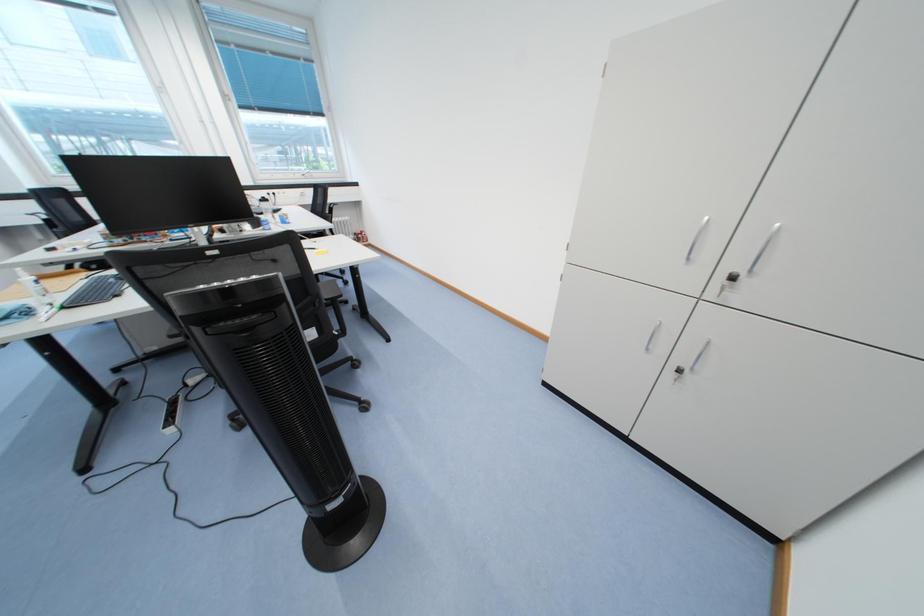
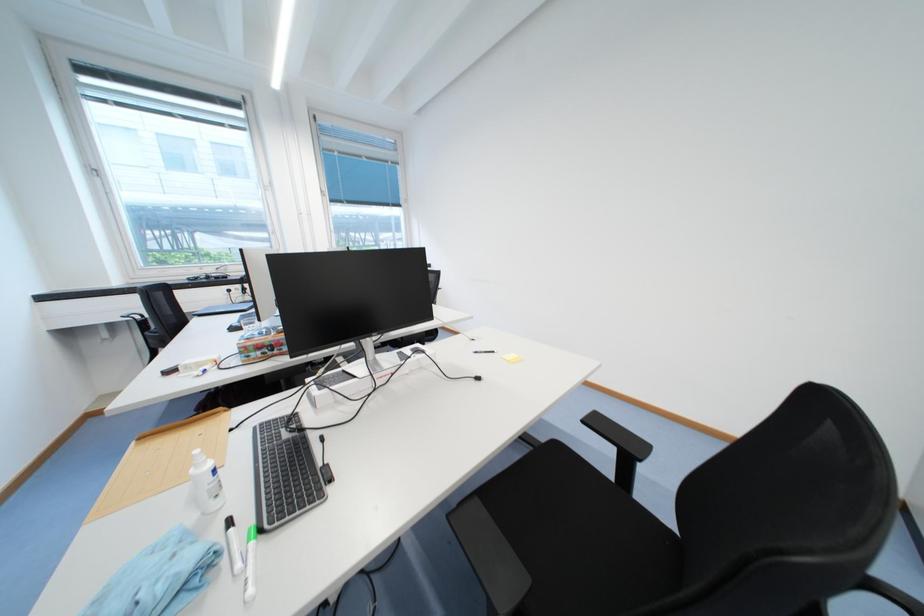
Question: The images are taken continuously from a first-person perspective. In which direction are you moving?

Choices:
 (A) Left
 (B) Right
 (C) Forward
 (D) Backward

Answer: (A)